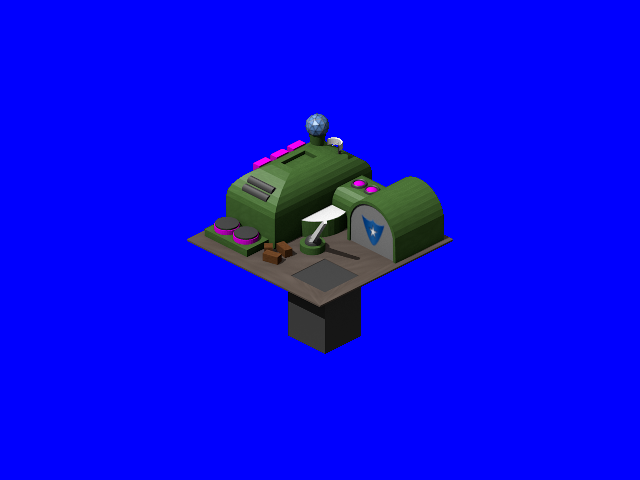
Where is `grey door`? grey door is located at coordinates (383, 244).